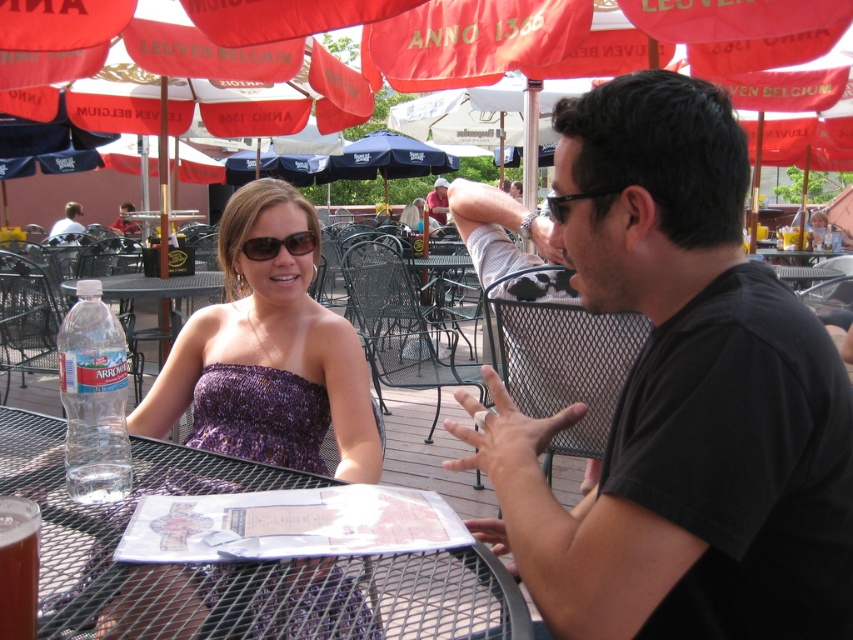
The image size is (853, 640). What are the coordinates of `black matte shirt at center` in the screenshot? It's located at (680, 397).

Between point (735, 131) and point (257, 241), which one is positioned in front?

Point (735, 131)

Image resolution: width=853 pixels, height=640 pixels. What do you see at coordinates (680, 397) in the screenshot? I see `black matte shirt at center` at bounding box center [680, 397].

Where is `black matte shirt at center`? The height and width of the screenshot is (640, 853). black matte shirt at center is located at coordinates (680, 397).

Does purple satin dress at center appear over matte black sunglasses at center?

Incorrect, purple satin dress at center is not positioned above matte black sunglasses at center.

Which is above, purple satin dress at center or matte black sunglasses at center?

Positioned higher is matte black sunglasses at center.

Does point (297, 314) come closer to viewer compared to point (291, 236)?

That is False.

Identify the location of purple satin dress at center. Image resolution: width=853 pixels, height=640 pixels. (268, 355).

Can you confirm if clear plastic bottle at table left is thinner than matte pink shirt at center?

Yes, clear plastic bottle at table left is thinner than matte pink shirt at center.

Is point (67, 472) closer to viewer compared to point (432, 209)?

Yes, point (67, 472) is in front of point (432, 209).

Based on the photo, who is more distant from viewer, [84,280] or [439,189]?

The point [439,189] is behind.

I want to click on clear plastic bottle at table left, so click(x=93, y=397).